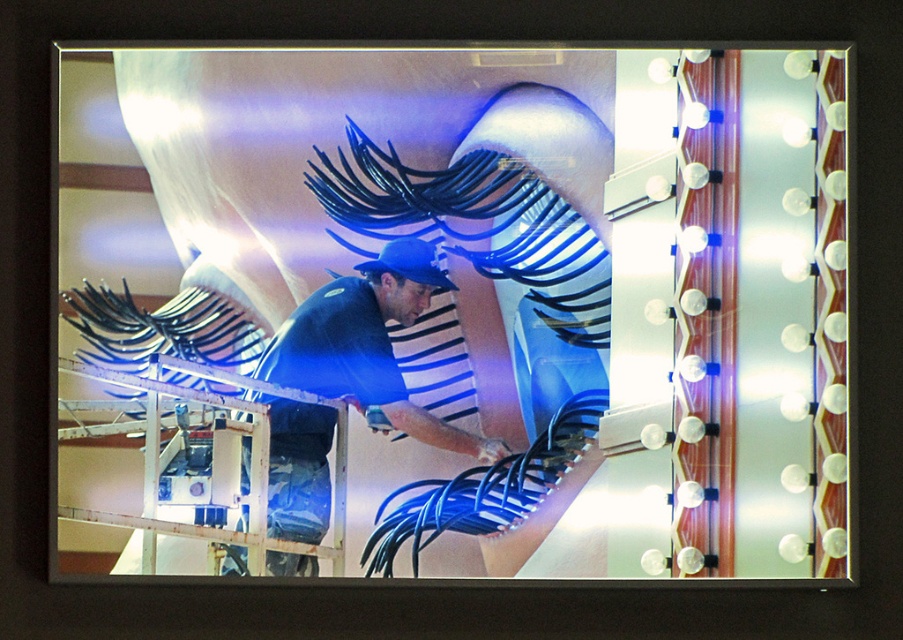
You are an inspector in the workshop and need to determine if the metallic silver mirror at center can be safely moved without damaging the blue matte shirt at center. Based on their sizes, which object takes up more space in the workspace?

The metallic silver mirror at center is larger in size than the blue matte shirt at center, so it occupies more space and would require more careful handling to avoid damaging the blue matte shirt at center.

You are standing at the entrance of the workshop and see two points marked in the scene. The first point is labeled as point (91, 164) and the second is point (318, 404). Which point is closer to you?

Point (318, 404) is closer to you because point (91, 164) is behind it.

You are an inspector in the workshop. You need to check the alignment between the metallic silver mirror at center and the blue matte shirt at center. Which object is positioned to the right side of the other?

The metallic silver mirror at center is to the right of blue matte shirt at center.